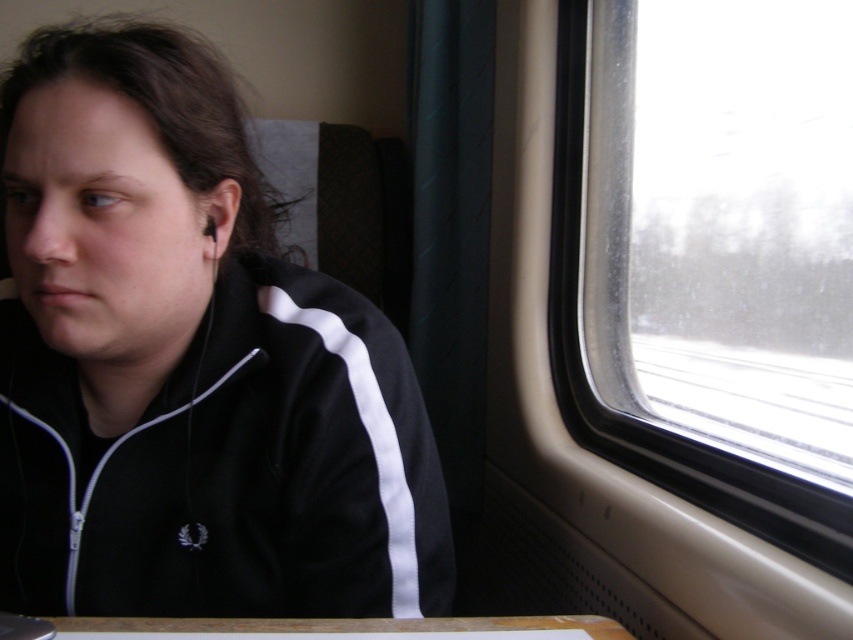
You are a designer trying to create a layout for a magazine spread. The scene includes a black matte jacket at left and a transparent glass window at right. Which object should you scale down to maintain visual balance between the two elements?

The black matte jacket at left is bigger than the transparent glass window at right, so you should scale down the black matte jacket at left to achieve visual balance between the two objects.